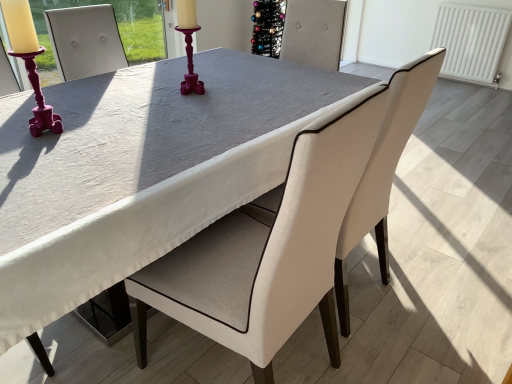
Find the location of a particular element. The image size is (512, 384). free space in front of matte pink candlestick at left is located at coordinates (36, 153).